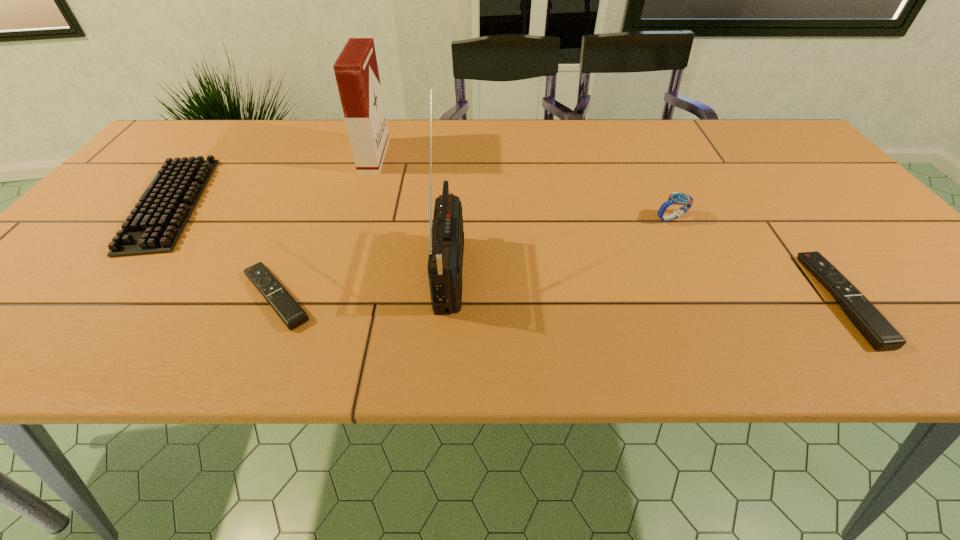
Where is `free point that satisfies the following two spatial constraints: 1. on the front-facing side of the cigarette_case; 2. on the right side of the right remote control`? This screenshot has width=960, height=540. free point that satisfies the following two spatial constraints: 1. on the front-facing side of the cigarette_case; 2. on the right side of the right remote control is located at coordinates (328, 299).